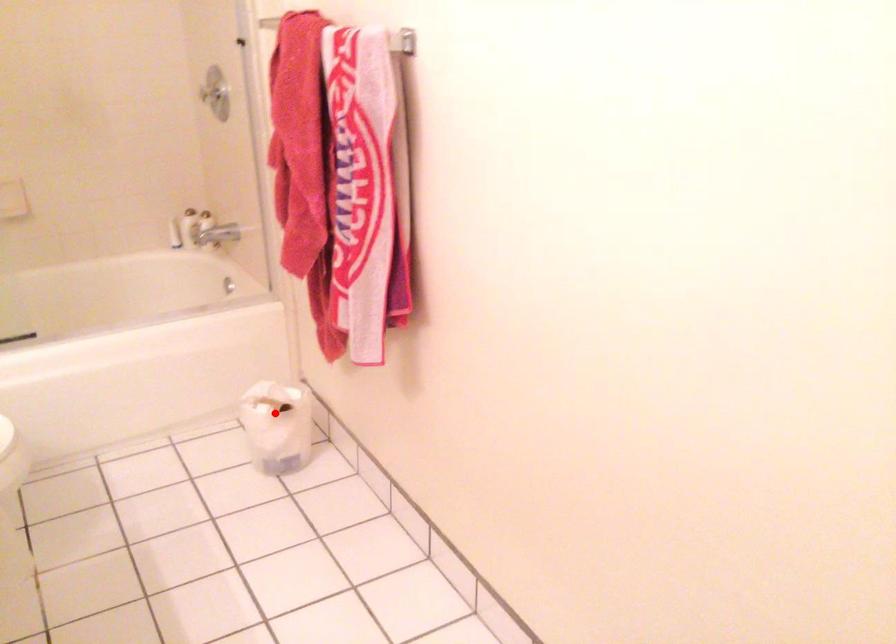
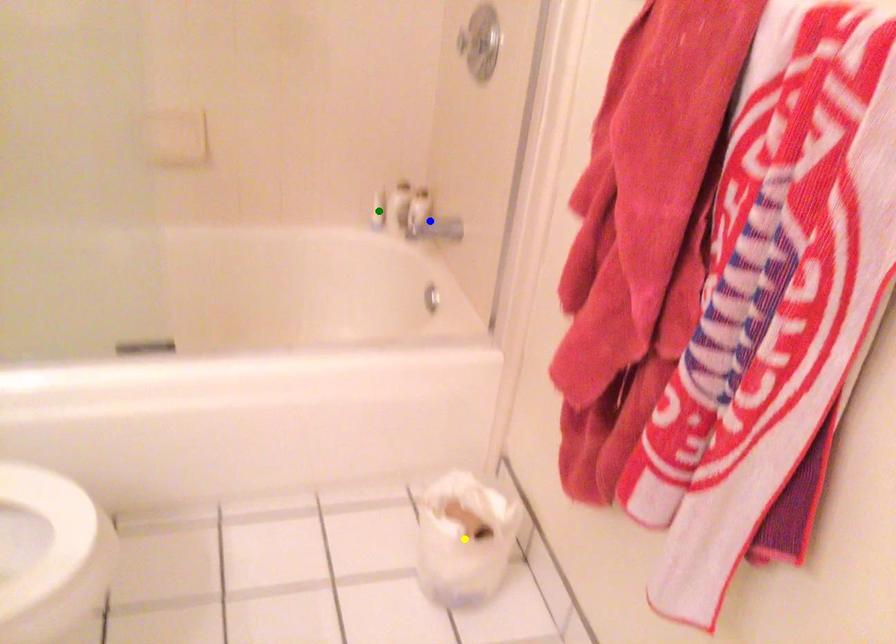
Question: I am providing you with two images of the same scene from different viewpoints. A red point is marked on the first image. You are given multiple points on the second image. Which mark in image 2 goes with the point in image 1?

Choices:
 (A) green point
 (B) blue point
 (C) yellow point

Answer: (C)